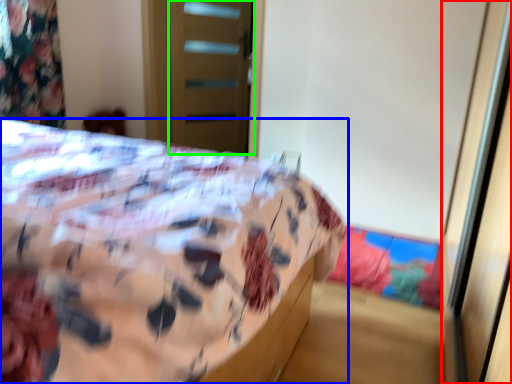
Question: Estimate the real-world distances between objects in this image. Which object is farther from screen door (highlighted by a red box), bed (highlighted by a blue box) or screen door (highlighted by a green box)?

Choices:
 (A) bed
 (B) screen door

Answer: (B)